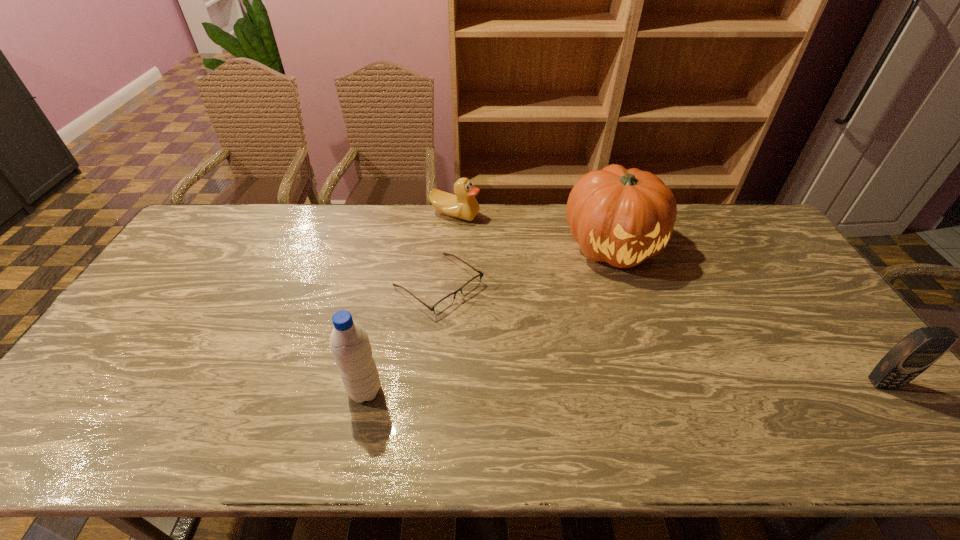
Where is `free space on the desktop that is between the water bottle and the cellular telephone and is positioned on the front-facing side of the spectacles`? free space on the desktop that is between the water bottle and the cellular telephone and is positioned on the front-facing side of the spectacles is located at coordinates (572, 388).

The width and height of the screenshot is (960, 540). In order to click on free space on the desktop that is between the water bottle and the third shortest object and is positioned on the carved face of the second object from right to left in this screenshot , I will do `click(692, 386)`.

The image size is (960, 540). In order to click on vacant space on the desktop that is between the water bottle and the cellular telephone and is positioned at the beak of the second shortest object in this screenshot , I will do `click(556, 388)`.